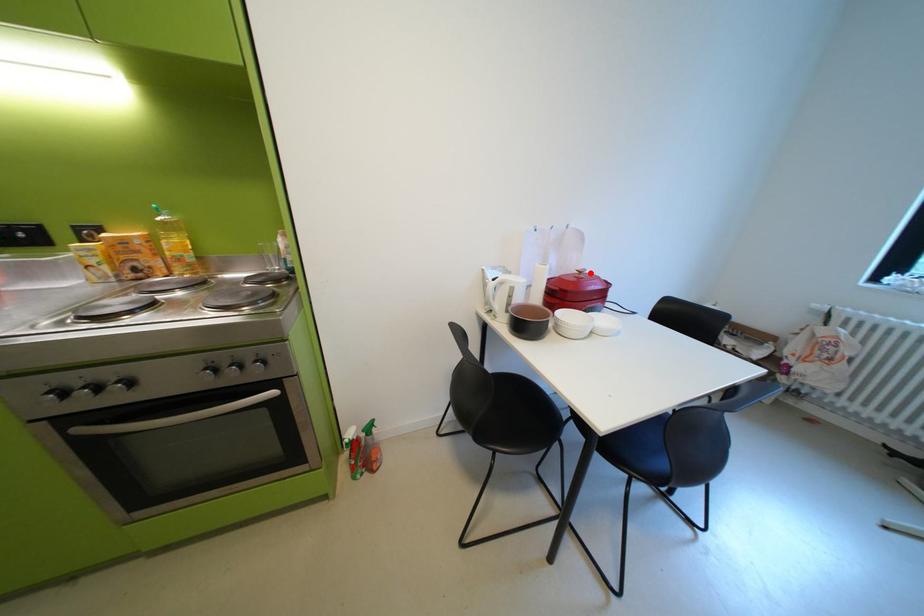
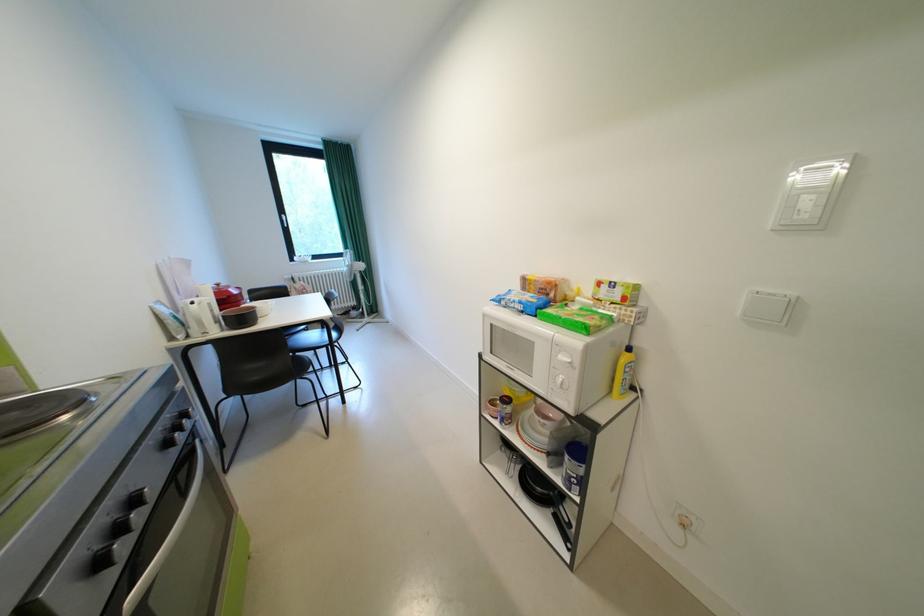
Question: I am providing you with two images of the same scene from different viewpoints. A red point is shown in image1. For the corresponding object point in image2, is it positioned nearer or farther from the camera?

Choices:
 (A) Nearer
 (B) Farther

Answer: (A)